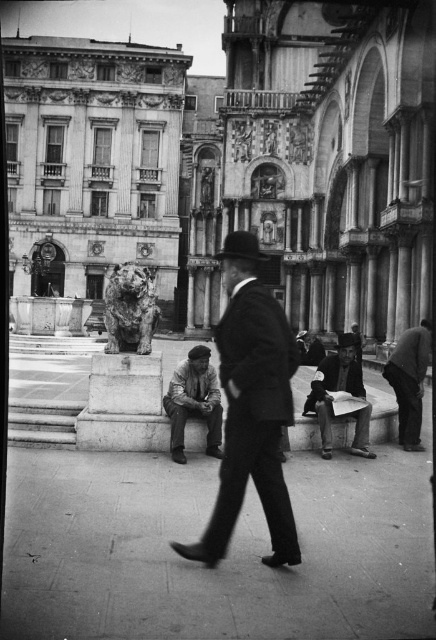
You are a photographer trying to capture both the smooth black suit at center and the smooth paper at center in a single frame. Given that your camera can only focus on objects within a 1.2 meter width, can you fit both objects into the frame without moving the camera?

The smooth black suit at center is wider than the smooth paper at center. Since the camera can focus on objects within a 1.2 meter width, you need to check if the combined width of both objects exceeds this limit. However, the exact widths are not provided, so it is uncertain whether they can fit without additional information.

You are a tourist standing in the city square and want to take a photo of the dark gray fabric cap at lower center. To avoid stepping on the smooth concrete pavement at center, where should you position yourself?

The smooth concrete pavement at center is located below the dark gray fabric cap at lower center, so you should position yourself behind or to the side of the dark gray fabric cap at lower center to avoid stepping on the pavement.

You are a delivery person with a cart that is 2 meters wide. You need to move from the statue of a lion on the left to the smooth concrete pavement at center. Can your cart fit through the space between them?

The distance between the statue of a lion on the left and the smooth concrete pavement at center is 23.32 meters. Since your cart is only 2 meters wide, there is ample space for it to pass through comfortably.